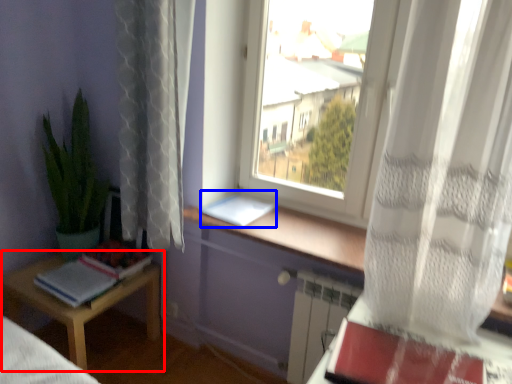
Question: Which object is further to the camera taking this photo, table (highlighted by a red box) or paperback book (highlighted by a blue box)?

Choices:
 (A) table
 (B) paperback book

Answer: (B)